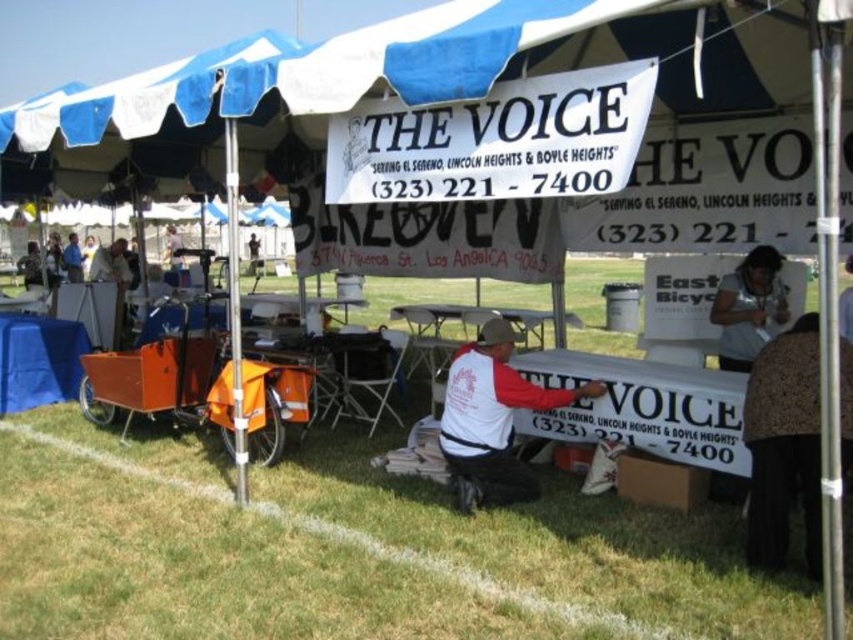
Can you confirm if white cotton shirt at center is shorter than blue fabric table at lower left?

Incorrect, white cotton shirt at center's height does not fall short of blue fabric table at lower left's.

Locate an element on the screen. The width and height of the screenshot is (853, 640). white cotton shirt at center is located at coordinates (492, 419).

Is point (454, 481) closer to viewer compared to point (86, 344)?

Yes, point (454, 481) is in front of point (86, 344).

Where is `white cotton shirt at center`? The height and width of the screenshot is (640, 853). white cotton shirt at center is located at coordinates (492, 419).

Looking at this image, does light brown leather jacket at upper right have a lesser width compared to metallic silver folding table at center?

In fact, light brown leather jacket at upper right might be wider than metallic silver folding table at center.

This screenshot has width=853, height=640. In order to click on light brown leather jacket at upper right in this screenshot , I will do `click(747, 307)`.

Find the location of a particular element. The width and height of the screenshot is (853, 640). light brown leather jacket at upper right is located at coordinates (747, 307).

Does blue fabric table at lower left have a larger size compared to light blue shirt at center?

No, blue fabric table at lower left is not bigger than light blue shirt at center.

The width and height of the screenshot is (853, 640). Find the location of `blue fabric table at lower left`. blue fabric table at lower left is located at coordinates (38, 360).